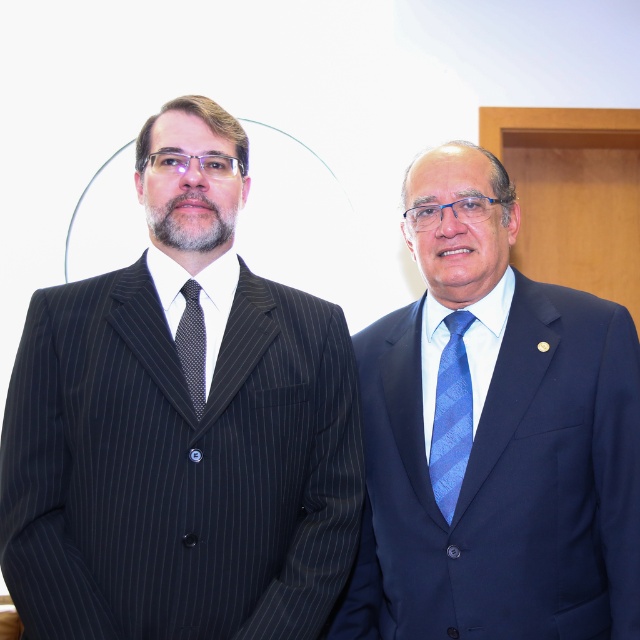
Who is shorter, blue satin suit at right or blue textured tie at right?

blue textured tie at right is shorter.

From the picture: Who is positioned more to the right, blue satin suit at right or blue textured tie at right?

From the viewer's perspective, blue satin suit at right appears more on the right side.

Between point (348, 625) and point (445, 388), which one is positioned in front?

Positioned in front is point (445, 388).

Where is `blue satin suit at right`? The image size is (640, 640). blue satin suit at right is located at coordinates (493, 435).

Which is more to the left, pinstriped suit at left or blue satin suit at right?

From the viewer's perspective, pinstriped suit at left appears more on the left side.

Between pinstriped suit at left and blue satin suit at right, which one has more height?

With more height is blue satin suit at right.

Where is `pinstriped suit at left`? This screenshot has width=640, height=640. pinstriped suit at left is located at coordinates (180, 428).

At what (x,y) coordinates should I click in order to perform the action: click on pinstriped suit at left. Please return your answer as a coordinate pair (x, y). This screenshot has width=640, height=640. Looking at the image, I should click on (180, 428).

Does blue textured tie at right have a lesser height compared to black dotted fabric tie at left?

No, blue textured tie at right is not shorter than black dotted fabric tie at left.

Is blue textured tie at right below black dotted fabric tie at left?

Yes.

Is point (456, 474) less distant than point (195, 406)?

No.

In order to click on blue textured tie at right in this screenshot , I will do (x=451, y=417).